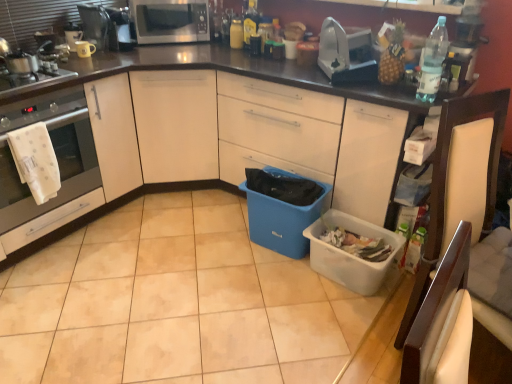
Where is `vacant area that is in front of white glossy microwave at upper center`? This screenshot has width=512, height=384. vacant area that is in front of white glossy microwave at upper center is located at coordinates (163, 51).